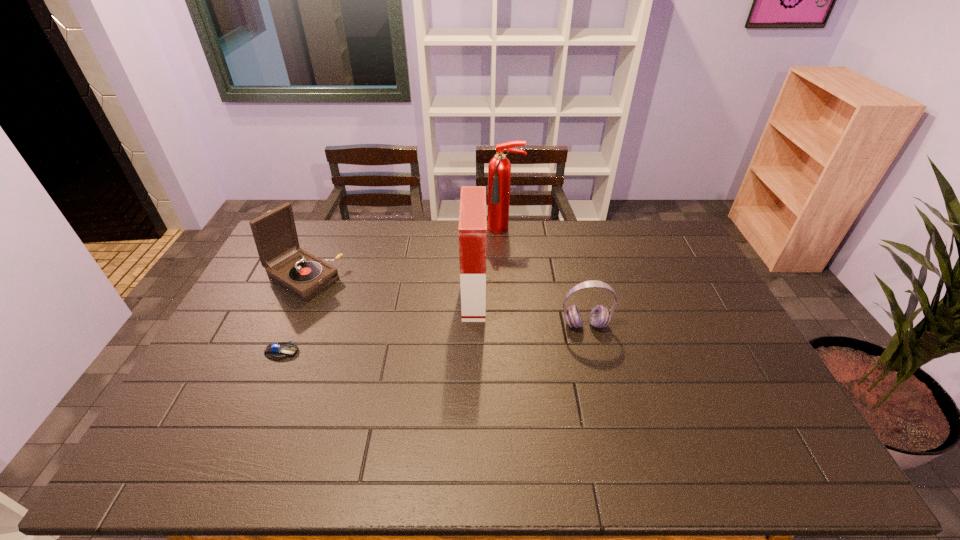
What are the coordinates of `empty location between the fire extinguisher and the nearest object` in the screenshot? It's located at (393, 291).

In order to click on empty location between the headset and the third object from right to left in this screenshot , I will do `click(530, 311)`.

Locate an element on the screen. The height and width of the screenshot is (540, 960). free spot between the third shortest object and the third object from left to right is located at coordinates (389, 288).

Identify the location of vacant space that is in between the computer mouse and the rightmost object. The image size is (960, 540). (433, 339).

This screenshot has width=960, height=540. I want to click on object that stands as the closest to the third object from right to left, so click(x=499, y=168).

Image resolution: width=960 pixels, height=540 pixels. Find the location of `object that can be found as the fourth closest to the rightmost object`. object that can be found as the fourth closest to the rightmost object is located at coordinates [x=277, y=351].

At what (x,y) coordinates should I click in order to perform the action: click on free region that satisfies the following two spatial constraints: 1. at the nozzle of the farthest object; 2. on the button side of the computer mouse. Please return your answer as a coordinate pair (x, y). The width and height of the screenshot is (960, 540). Looking at the image, I should click on (514, 352).

Where is `free space that satisfies the following two spatial constraints: 1. at the nozzle of the second object from right to left; 2. on the button side of the computer mouse`? Image resolution: width=960 pixels, height=540 pixels. free space that satisfies the following two spatial constraints: 1. at the nozzle of the second object from right to left; 2. on the button side of the computer mouse is located at coordinates (514, 352).

I want to click on free space that satisfies the following two spatial constraints: 1. on the headband and ear cups of the second shortest object; 2. on the button side of the nearest object, so (592, 352).

Where is `vacant point that satisfies the following two spatial constraints: 1. at the nozzle of the fourth object from left to right; 2. on the front-facing side of the cigarette_case`? This screenshot has width=960, height=540. vacant point that satisfies the following two spatial constraints: 1. at the nozzle of the fourth object from left to right; 2. on the front-facing side of the cigarette_case is located at coordinates pyautogui.click(x=510, y=297).